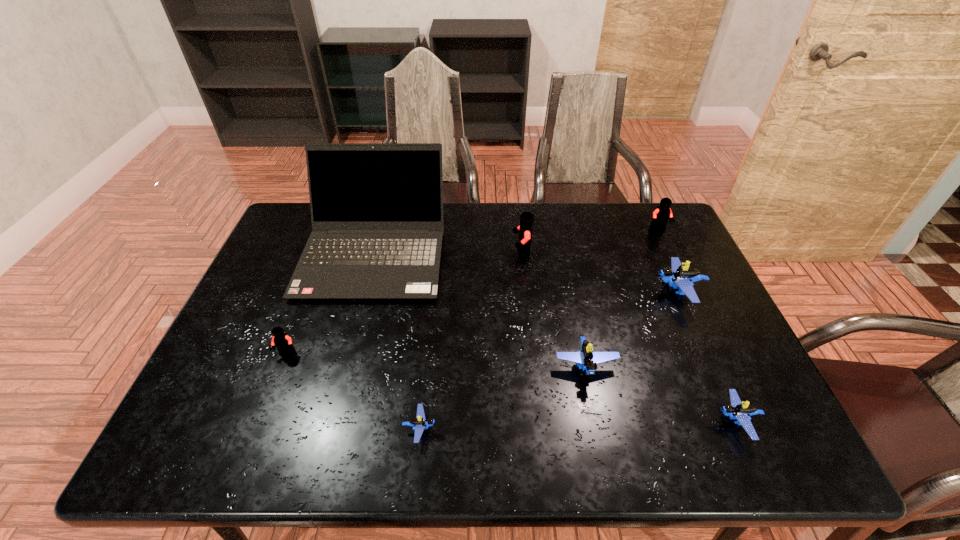
Find the location of a particular element. unoccupied position between the second farthest blue Lego and the black laptop computer is located at coordinates (480, 309).

This screenshot has width=960, height=540. I want to click on empty space that is in between the laptop computer and the second Lego from left to right, so pyautogui.click(x=397, y=340).

The image size is (960, 540). In order to click on the fifth closest object to the leftmost black Lego in this screenshot , I will do `click(680, 277)`.

This screenshot has height=540, width=960. I want to click on object that is the second closest to the second smallest blue Lego, so click(x=680, y=277).

Point out which Lego is positioned as the fourth nearest to the second nearest black Lego. Please provide its 2D coordinates. Your answer should be formatted as a tuple, i.e. [(x, y)], where the tuple contains the x and y coordinates of a point satisfying the conditions above.

[(419, 423)]

This screenshot has width=960, height=540. Identify the location of Lego identified as the second closest to the shortest Lego. point(283,342).

Find the location of `black Lego that stands as the second closest to the third biggest blue Lego`. black Lego that stands as the second closest to the third biggest blue Lego is located at coordinates 661,215.

At what (x,y) coordinates should I click in order to perform the action: click on black Lego that can be found as the second closest to the farthest black Lego. Please return your answer as a coordinate pair (x, y). This screenshot has width=960, height=540. Looking at the image, I should click on (283, 342).

This screenshot has width=960, height=540. Find the location of `the fourth closest blue Lego to the second biggest black Lego`. the fourth closest blue Lego to the second biggest black Lego is located at coordinates (419, 423).

Select which blue Lego appears as the third closest to the leftmost black Lego. Please provide its 2D coordinates. Your answer should be formatted as a tuple, i.e. [(x, y)], where the tuple contains the x and y coordinates of a point satisfying the conditions above.

[(680, 277)]